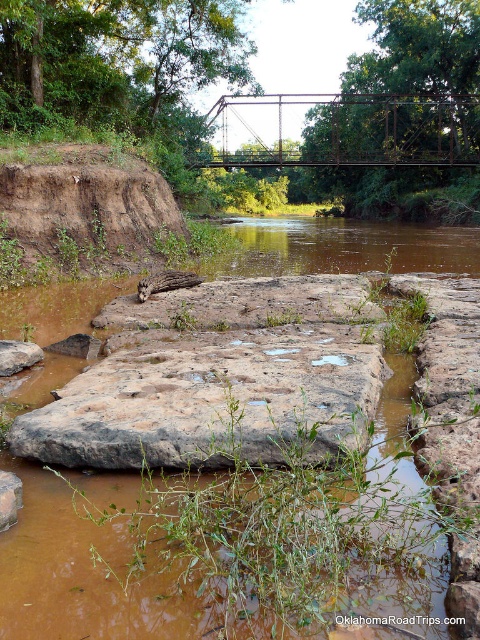
You are a hiker who needs to cross the river. You see a brown rough rock at center and a rusty metal bridge at upper center. Which path would allow you to cross the river safely? Please consider the distance between them and the available structures.

The rusty metal bridge at upper center is the safer path to cross the river since it is a constructed structure designed for crossing. The brown rough rock at center, while accessible, may be slippery or unstable due to its rough texture and submerged position. The distance between them is 35.25 meters, so the bridge is farther away but provides a safer option.

You are standing at the origin point of the image. Where is the brown muddy water at center located?

The brown muddy water at center is located at point [72,573].

You are standing at the riverbank and see two points marked in the image. Which point, point (393,237) or point (24,360), is closer to you?

Point (393,237) is closer to you because it is further to the viewer than point (24,360).